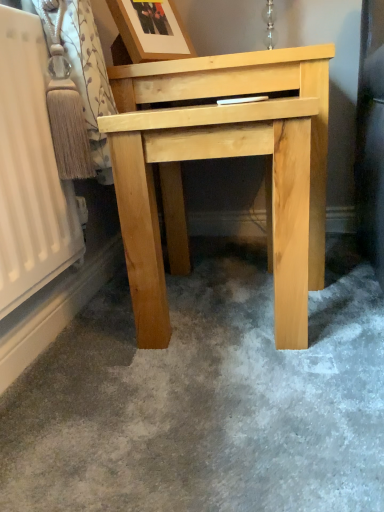
Question: From the image's perspective, is natural wood table at center beneath wooden picture frame at upper center?

Choices:
 (A) no
 (B) yes

Answer: (B)

Question: Are natural wood table at center and wooden picture frame at upper center beside each other?

Choices:
 (A) no
 (B) yes

Answer: (A)

Question: Is natural wood table at center positioned before wooden picture frame at upper center?

Choices:
 (A) no
 (B) yes

Answer: (B)

Question: Could you tell me if natural wood table at center is turned towards wooden picture frame at upper center?

Choices:
 (A) no
 (B) yes

Answer: (A)

Question: Can we say natural wood table at center lies outside wooden picture frame at upper center?

Choices:
 (A) yes
 (B) no

Answer: (A)

Question: Is natural wood table at center taller than wooden picture frame at upper center?

Choices:
 (A) no
 (B) yes

Answer: (B)

Question: Does wooden picture frame at upper center have a smaller size compared to natural wood table at center?

Choices:
 (A) yes
 (B) no

Answer: (A)

Question: Considering the relative sizes of wooden picture frame at upper center and natural wood table at center in the image provided, is wooden picture frame at upper center shorter than natural wood table at center?

Choices:
 (A) no
 (B) yes

Answer: (B)

Question: Can you confirm if wooden picture frame at upper center is positioned to the right of natural wood table at center?

Choices:
 (A) yes
 (B) no

Answer: (B)

Question: Is the position of wooden picture frame at upper center more distant than that of natural wood table at center?

Choices:
 (A) yes
 (B) no

Answer: (A)

Question: Is wooden picture frame at upper center next to natural wood table at center and touching it?

Choices:
 (A) yes
 (B) no

Answer: (B)

Question: Does wooden picture frame at upper center have a greater height compared to natural wood table at center?

Choices:
 (A) no
 (B) yes

Answer: (A)

Question: Is wooden picture frame at upper center bigger or smaller than natural wood table at center?

Choices:
 (A) big
 (B) small

Answer: (B)